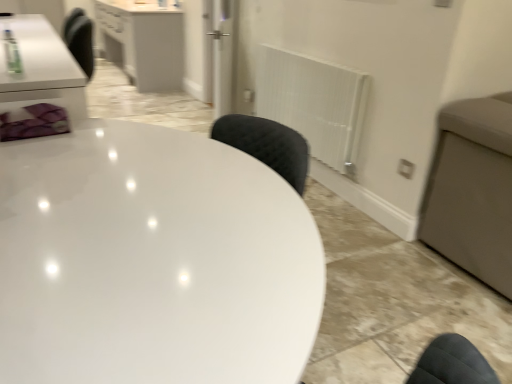
What are the coordinates of `transparent glass door at center` in the screenshot? It's located at (222, 54).

Locate an element on the screen. white glossy table at center is located at coordinates (152, 261).

Image resolution: width=512 pixels, height=384 pixels. Describe the element at coordinates (144, 41) in the screenshot. I see `white glossy cabinet at upper left` at that location.

In order to click on transparent glass door at center in this screenshot , I will do `click(222, 54)`.

Which of these two, white glossy table at center or transparent glass door at center, stands taller?

transparent glass door at center.

Based on the photo, is white glossy table at center positioned with its back to transparent glass door at center?

No.

Identify the location of glass door on the left of white glossy table at center. Image resolution: width=512 pixels, height=384 pixels. (222, 54).

Is white glossy table at center positioned far away from transparent glass door at center?

white glossy table at center is far away from transparent glass door at center.

Can you confirm if white glossy table at center is smaller than white glossy cabinet at upper left?

Yes.

Is white glossy table at center positioned far away from white glossy cabinet at upper left?

white glossy table at center is far away from white glossy cabinet at upper left.

Is white glossy table at center oriented away from white glossy cabinet at upper left?

No, white glossy table at center's orientation is not away from white glossy cabinet at upper left.

Which is nearer, (143,364) or (156,34)?

Positioned in front is point (143,364).

From a real-world perspective, is white glossy cabinet at upper left physically located above or below transparent glass door at center?

From a real-world perspective, white glossy cabinet at upper left is physically below transparent glass door at center.

Does point (123, 14) come closer to viewer compared to point (226, 93)?

No, (123, 14) is further to viewer.

Measure the distance between white glossy cabinet at upper left and transparent glass door at center.

The distance of white glossy cabinet at upper left from transparent glass door at center is 1.16 meters.

From their relative heights in the image, would you say white glossy cabinet at upper left is taller or shorter than white glossy table at center?

In the image, white glossy cabinet at upper left appears to be taller than white glossy table at center.

Does white glossy cabinet at upper left come in front of white glossy table at center?

No, white glossy cabinet at upper left is behind white glossy table at center.

Where is `radiator behind the white glossy table at center`? The height and width of the screenshot is (384, 512). radiator behind the white glossy table at center is located at coordinates (314, 103).

Between white textured radiator at center right and white glossy table at center, which one has smaller width?

Thinner between the two is white textured radiator at center right.

Consider the image. Considering their positions, is white textured radiator at center right located in front of or behind white glossy table at center?

white textured radiator at center right is behind white glossy table at center.

Looking at the image, does transparent glass door at center seem bigger or smaller compared to white glossy cabinet at upper left?

In the image, transparent glass door at center appears to be smaller than white glossy cabinet at upper left.

Is transparent glass door at center wider than white glossy cabinet at upper left?

No, transparent glass door at center is not wider than white glossy cabinet at upper left.

Based on the photo, which point is more forward, (230, 105) or (160, 15)?

The point (230, 105) is more forward.

Considering the positions of objects transparent glass door at center and white glossy cabinet at upper left in the image provided, who is behind, transparent glass door at center or white glossy cabinet at upper left?

Positioned behind is white glossy cabinet at upper left.

How much distance is there between transparent glass door at center and white textured radiator at center right?

transparent glass door at center is 1.17 meters away from white textured radiator at center right.

Is transparent glass door at center positioned beyond the bounds of white textured radiator at center right?

Yes, transparent glass door at center is outside of white textured radiator at center right.

Considering the relative sizes of transparent glass door at center and white textured radiator at center right in the image provided, is transparent glass door at center shorter than white textured radiator at center right?

No, transparent glass door at center is not shorter than white textured radiator at center right.

Looking at their sizes, would you say transparent glass door at center is wider or thinner than white textured radiator at center right?

Considering their sizes, transparent glass door at center looks broader than white textured radiator at center right.

Where is `glass door above the white glossy table at center (from a real-world perspective)`? glass door above the white glossy table at center (from a real-world perspective) is located at coordinates (222, 54).

Image resolution: width=512 pixels, height=384 pixels. Find the location of `cabinetry behind the white glossy table at center`. cabinetry behind the white glossy table at center is located at coordinates (144, 41).

Based on their spatial positions, is white glossy cabinet at upper left or white glossy table at center further from white textured radiator at center right?

white glossy cabinet at upper left lies further to white textured radiator at center right than the other object.

Estimate the real-world distances between objects in this image. Which object is further from white glossy table at center, white glossy cabinet at upper left or white textured radiator at center right?

Among the two, white glossy cabinet at upper left is located further to white glossy table at center.

When comparing their distances from transparent glass door at center, does white glossy cabinet at upper left or white textured radiator at center right seem closer?

Among the two, white glossy cabinet at upper left is located nearer to transparent glass door at center.

Estimate the real-world distances between objects in this image. Which object is further from white textured radiator at center right, white glossy table at center or white glossy cabinet at upper left?

white glossy cabinet at upper left is positioned further to the anchor white textured radiator at center right.

When comparing their distances from white glossy table at center, does transparent glass door at center or white textured radiator at center right seem closer?

white textured radiator at center right lies closer to white glossy table at center than the other object.

Considering their positions, is transparent glass door at center positioned further to white glossy table at center than white glossy cabinet at upper left?

Based on the image, white glossy cabinet at upper left appears to be further to white glossy table at center.

Based on their spatial positions, is transparent glass door at center or white glossy table at center closer to white glossy cabinet at upper left?

The object closer to white glossy cabinet at upper left is transparent glass door at center.

Estimate the real-world distances between objects in this image. Which object is closer to white textured radiator at center right, white glossy cabinet at upper left or transparent glass door at center?

Among the two, transparent glass door at center is located nearer to white textured radiator at center right.

Where is `radiator between white glossy table at center and white glossy cabinet at upper left in the front-back direction`? The height and width of the screenshot is (384, 512). radiator between white glossy table at center and white glossy cabinet at upper left in the front-back direction is located at coordinates (314, 103).

Image resolution: width=512 pixels, height=384 pixels. What are the coordinates of `glass door between white textured radiator at center right and white glossy cabinet at upper left along the z-axis` in the screenshot? It's located at (222, 54).

Find the location of a particular element. glass door between white glossy table at center and white glossy cabinet at upper left along the z-axis is located at coordinates (222, 54).

At what (x,y) coordinates should I click in order to perform the action: click on radiator between white glossy table at center and transparent glass door at center along the z-axis. Please return your answer as a coordinate pair (x, y). This screenshot has width=512, height=384. Looking at the image, I should click on (314, 103).